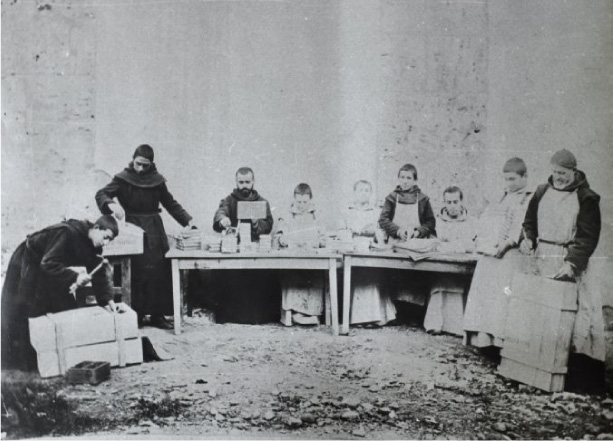
What are the coordinates of `textured background wall` in the screenshot? It's located at (417, 101).